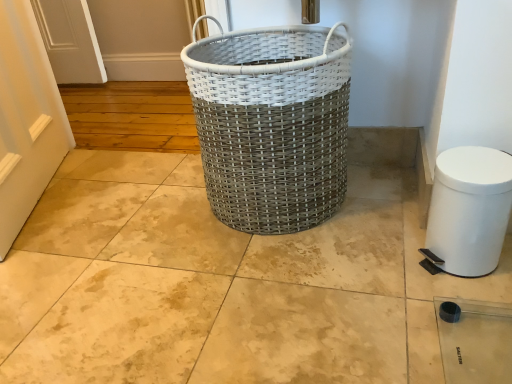
Where is `empty space that is ontop of white plastic trash can at lower right`? The image size is (512, 384). empty space that is ontop of white plastic trash can at lower right is located at coordinates (470, 165).